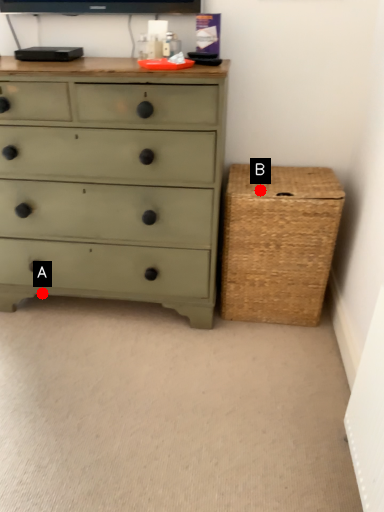
Question: Two points are circled on the image, labeled by A and B beside each circle. Which point is further to the camera?

Choices:
 (A) A is further
 (B) B is further

Answer: (A)